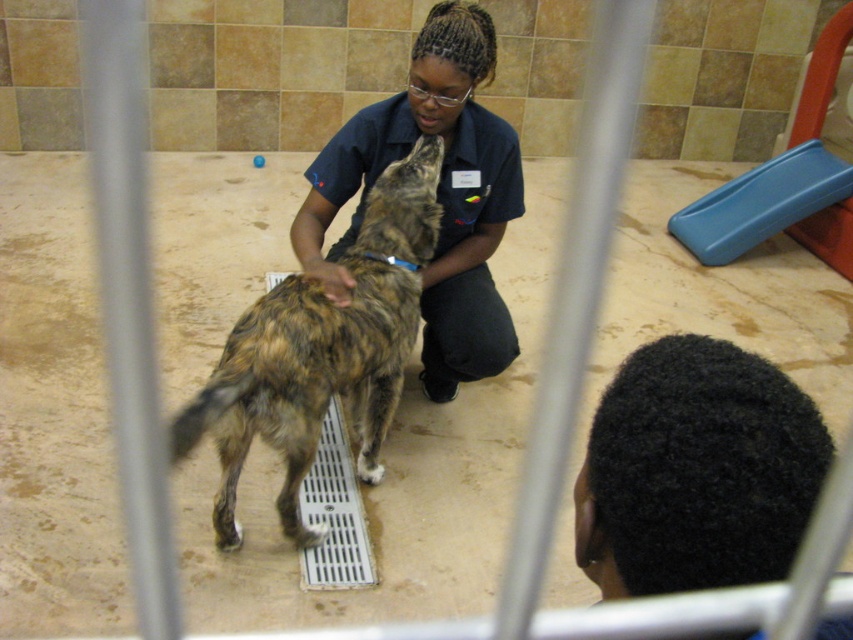
Does brown fur dog at center appear on the right side of dark blue uniform at center?

In fact, brown fur dog at center is to the left of dark blue uniform at center.

Who is more distant from viewer, (x=378, y=384) or (x=428, y=317)?

Positioned behind is point (x=428, y=317).

Identify the location of brown fur dog at center. This screenshot has height=640, width=853. (321, 352).

You are a GUI agent. You are given a task and a screenshot of the screen. Output one action in this format:
    pyautogui.click(x=<x>, y=<y>)
    Task: Click on the brown fur dog at center
    
    Given the screenshot: What is the action you would take?
    pyautogui.click(x=321, y=352)